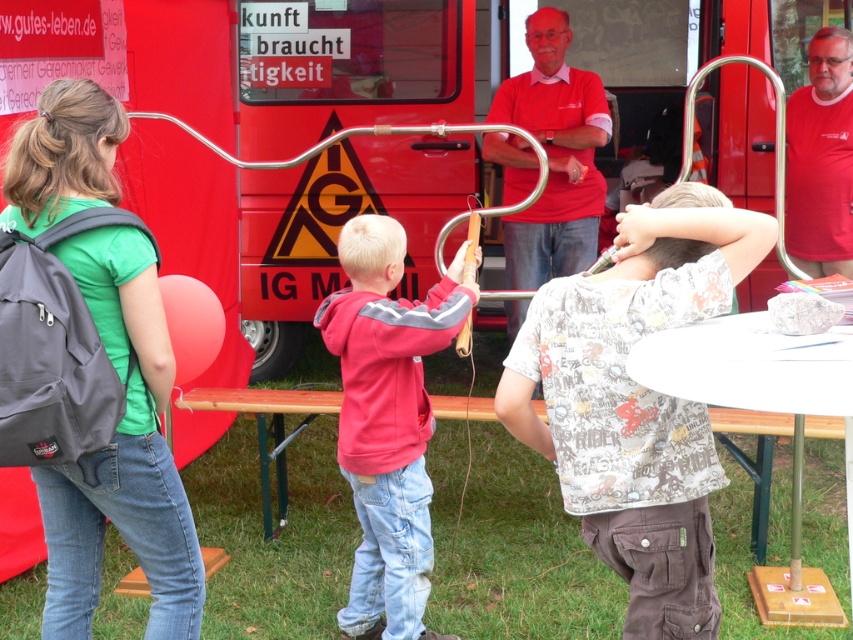
Question: Which object is the farthest from the red fleece hoodie at center?

Choices:
 (A) white printed t-shirt at center
 (B) matte red shirt at center
 (C) red cotton shirt at center

Answer: (C)

Question: Is white printed t-shirt at center to the right of matte red shirt at center from the viewer's perspective?

Choices:
 (A) yes
 (B) no

Answer: (B)

Question: Does red fleece hoodie at center appear under red cotton shirt at center?

Choices:
 (A) yes
 (B) no

Answer: (A)

Question: Can you confirm if red fleece hoodie at center is positioned below matte red shirt at center?

Choices:
 (A) yes
 (B) no

Answer: (A)

Question: Estimate the real-world distances between objects in this image. Which object is closer to the matte red shirt at center?

Choices:
 (A) white plastic picnic table at lower center
 (B) red fleece hoodie at center

Answer: (B)

Question: Which of the following is the closest to the observer?

Choices:
 (A) (809, 48)
 (B) (364, 340)
 (C) (508, 108)
 (D) (685, 412)

Answer: (D)